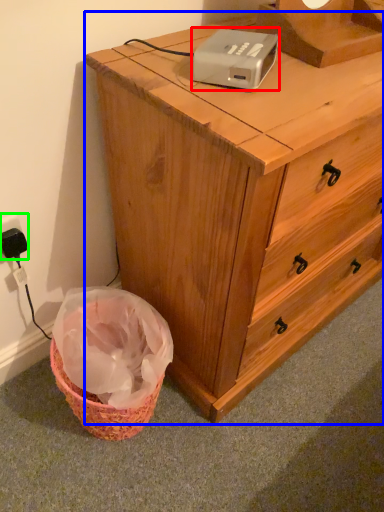
Question: Which object is positioned closest to gadget (highlighted by a red box)? Select from chest of drawers (highlighted by a blue box) and electric outlet (highlighted by a green box).

Choices:
 (A) chest of drawers
 (B) electric outlet

Answer: (A)